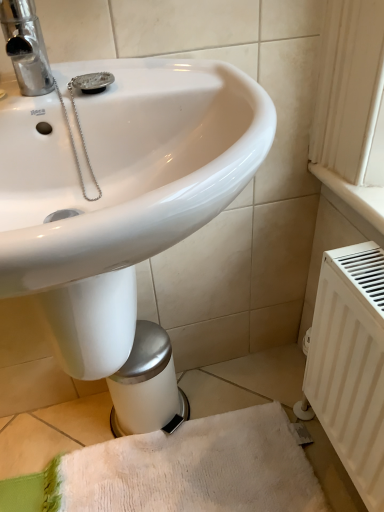
Question: Does point (185, 489) appear closer or farther from the camera than point (337, 437)?

Choices:
 (A) closer
 (B) farther

Answer: (B)

Question: From their relative heights in the image, would you say white textured bath towel at lower center is taller or shorter than white matte radiator at right?

Choices:
 (A) short
 (B) tall

Answer: (A)

Question: Is white textured bath towel at lower center in front of or behind white matte radiator at right in the image?

Choices:
 (A) front
 (B) behind

Answer: (B)

Question: Considering the positions of white matte radiator at right and white textured bath towel at lower center in the image, is white matte radiator at right bigger or smaller than white textured bath towel at lower center?

Choices:
 (A) big
 (B) small

Answer: (A)

Question: From the image's perspective, is white matte radiator at right located above or below white textured bath towel at lower center?

Choices:
 (A) below
 (B) above

Answer: (B)

Question: Is white matte radiator at right wider or thinner than white textured bath towel at lower center?

Choices:
 (A) thin
 (B) wide

Answer: (A)

Question: Is white matte radiator at right situated inside white textured bath towel at lower center or outside?

Choices:
 (A) inside
 (B) outside

Answer: (B)